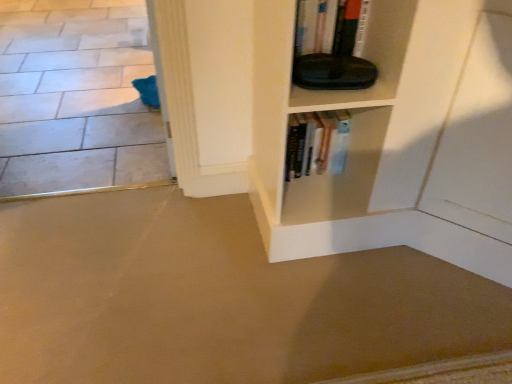
Question: Which is correct: white tile floor at lower left, which is the second concrete in front-to-back order, is inside beige carpet at lower left, acting as the 2th concrete starting from the top, or outside of it?

Choices:
 (A) outside
 (B) inside

Answer: (A)

Question: From a real-world perspective, relative to beige carpet at lower left, acting as the 2th concrete starting from the top, is white tile floor at lower left, which appears as the first concrete when viewed from the back, vertically above or below?

Choices:
 (A) above
 (B) below

Answer: (B)

Question: Which is farther from the hardcover books at center?

Choices:
 (A) white tile floor at lower left, placed as the 1th concrete when sorted from top to bottom
 (B) beige carpet at lower left, acting as the 2th concrete starting from the top

Answer: (A)

Question: Based on their relative distances, which object is nearer to the hardcover books at center?

Choices:
 (A) beige carpet at lower left, marked as the second concrete in a back-to-front arrangement
 (B) white tile floor at lower left, which is the second concrete in front-to-back order

Answer: (A)